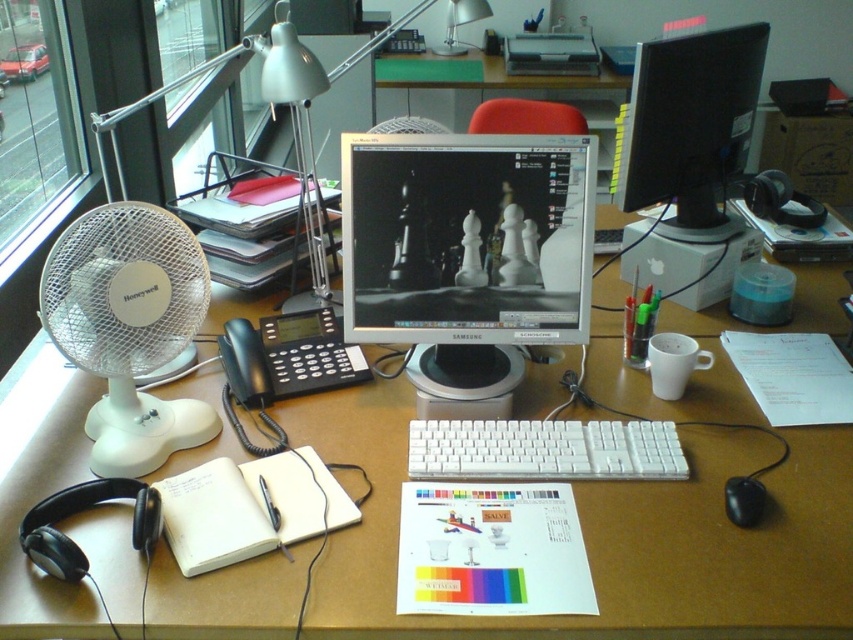
You are a delivery robot with a 12 inch wide package. You need to place it on the desk between the satin black monitor at center and the black plastic mouse at lower right. Is there enough space between them to fit the package?

The distance between the satin black monitor at center and the black plastic mouse at lower right is 21.11 inches. Since the package is 12 inches wide, there is sufficient space to place it between them.

You are an office worker who needs to place a new 50 cm wide document on the desk. Considering the distance between the white plastic desk at center and the black glossy monitor at upper right, will the document fit horizontally on the desk without overlapping the monitor?

The distance between the white plastic desk at center and the black glossy monitor at upper right is 54.54 centimeters. Since the document is 50 cm wide, it will fit horizontally on the desk without overlapping the monitor as there is enough space between them.

You are setting up a new desk and want to place the satin black monitor at center and the black plastic mouse at lower right. Given that the mouse requires a flat surface area of 10x10 cm, can you confirm if there is enough space on the desk next to the monitor?

The satin black monitor at center is much taller than the black plastic mouse at lower right, but the description does not provide information about the horizontal space available next to the monitor. Therefore, it is uncertain if there is enough space for the mouse.